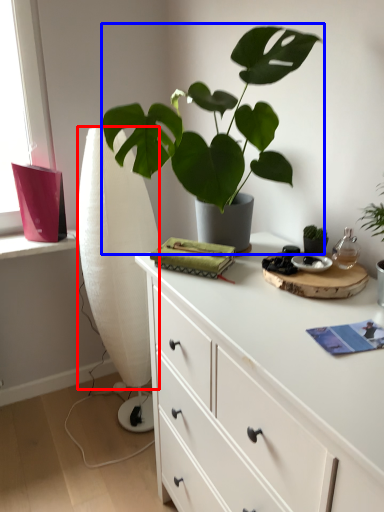
Question: Which of the following is the farthest to the observer, curtain (highlighted by a red box) or houseplant (highlighted by a blue box)?

Choices:
 (A) curtain
 (B) houseplant

Answer: (A)